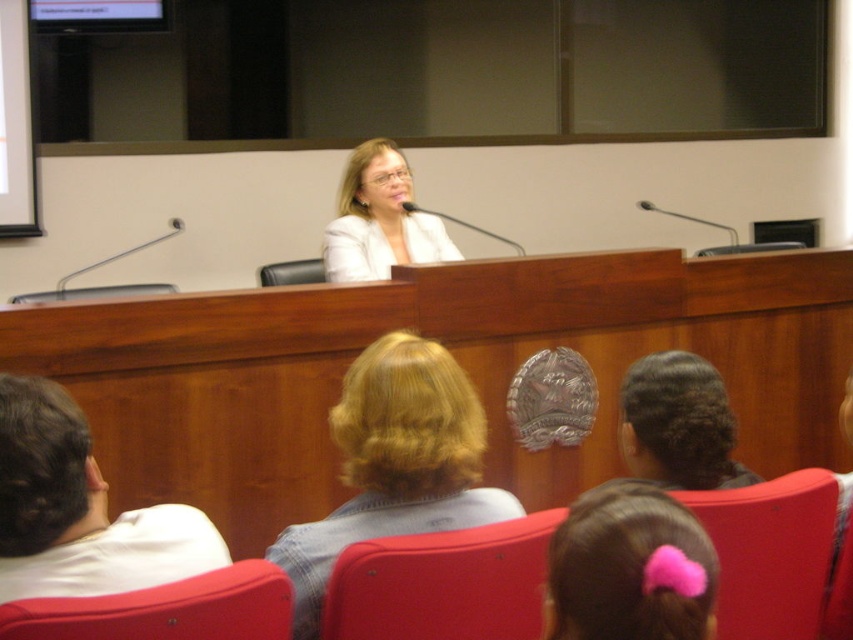
The image size is (853, 640). Describe the element at coordinates (395, 464) in the screenshot. I see `blonde hair at center` at that location.

Does blonde hair at center have a smaller size compared to matte red chair at lower left?

Incorrect, blonde hair at center is not smaller in size than matte red chair at lower left.

Describe the element at coordinates (395, 464) in the screenshot. I see `blonde hair at center` at that location.

Identify the location of blonde hair at center. The height and width of the screenshot is (640, 853). (395, 464).

Is point (338, 196) positioned before point (96, 289)?

That is False.

What do you see at coordinates (379, 220) in the screenshot?
I see `matte white jacket at center` at bounding box center [379, 220].

I want to click on matte white jacket at center, so click(x=379, y=220).

Is blonde hair at center above matte plastic chair at lower right?

Indeed, blonde hair at center is positioned over matte plastic chair at lower right.

Is blonde hair at center taller than matte plastic chair at lower right?

Correct, blonde hair at center is much taller as matte plastic chair at lower right.

Between point (410, 483) and point (717, 512), which one is positioned in front?

Point (410, 483)

This screenshot has width=853, height=640. Find the location of `blonde hair at center`. blonde hair at center is located at coordinates (395, 464).